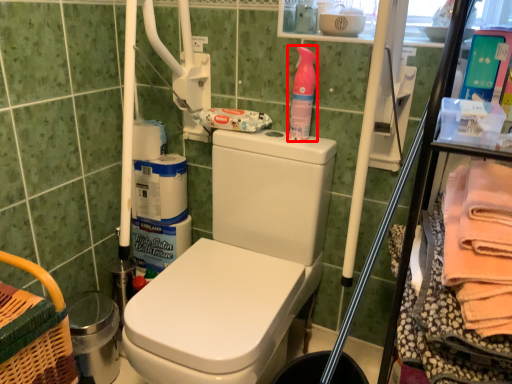
Question: Where is cleaning product (annotated by the red box) located in relation to material in the image?

Choices:
 (A) right
 (B) left

Answer: (B)